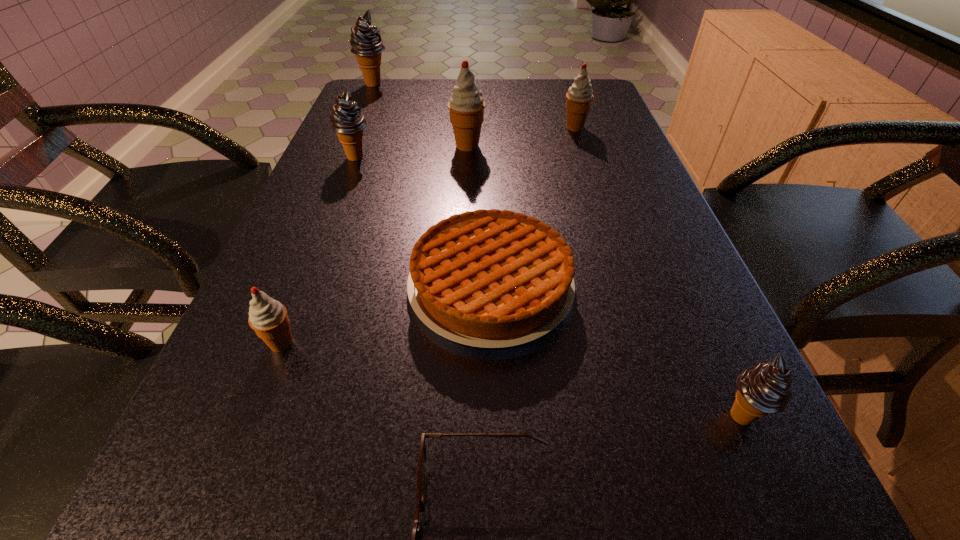
Where is `vacant area that lies between the second biggest chocolate icecream and the pie`? vacant area that lies between the second biggest chocolate icecream and the pie is located at coordinates (423, 221).

At what (x,y) coordinates should I click in order to perform the action: click on object identified as the second closest to the second farthest chocolate icecream. Please return your answer as a coordinate pair (x, y). Looking at the image, I should click on (493, 278).

Locate which object is the second closest to the second smallest chocolate icecream. Please provide its 2D coordinates. Your answer should be formatted as a tuple, i.e. [(x, y)], where the tuple contains the x and y coordinates of a point satisfying the conditions above.

[(493, 278)]

You are a GUI agent. You are given a task and a screenshot of the screen. Output one action in this format:
    pyautogui.click(x=<x>, y=<y>)
    Task: Click on the third closest icecream to the leftmost red icecream
    
    Given the screenshot: What is the action you would take?
    pyautogui.click(x=763, y=389)

Choose which icecream is the second nearest neighbor to the second farthest chocolate icecream. Please provide its 2D coordinates. Your answer should be formatted as a tuple, i.e. [(x, y)], where the tuple contains the x and y coordinates of a point satisfying the conditions above.

[(366, 42)]

Locate which chocolate icecream is the third closest to the nearest object. Please provide its 2D coordinates. Your answer should be formatted as a tuple, i.e. [(x, y)], where the tuple contains the x and y coordinates of a point satisfying the conditions above.

[(366, 42)]

Choose which chocolate icecream is the second nearest neighbor to the biggest chocolate icecream. Please provide its 2D coordinates. Your answer should be formatted as a tuple, i.e. [(x, y)], where the tuple contains the x and y coordinates of a point satisfying the conditions above.

[(763, 389)]

The width and height of the screenshot is (960, 540). I want to click on red icecream that is the second closest one to the second farthest object, so click(x=268, y=318).

You are a GUI agent. You are given a task and a screenshot of the screen. Output one action in this format:
    pyautogui.click(x=<x>, y=<y>)
    Task: Click on the red icecream that stands as the second closest to the second nearest red icecream
    Image resolution: width=960 pixels, height=540 pixels.
    Given the screenshot: What is the action you would take?
    pyautogui.click(x=268, y=318)

At what (x,y) coordinates should I click in order to perform the action: click on free space that satisfies the following two spatial constraints: 1. on the back side of the second nearest red icecream; 2. on the left side of the second biggest chocolate icecream. Please return your answer as a coordinate pair (x, y). Looking at the image, I should click on (360, 146).